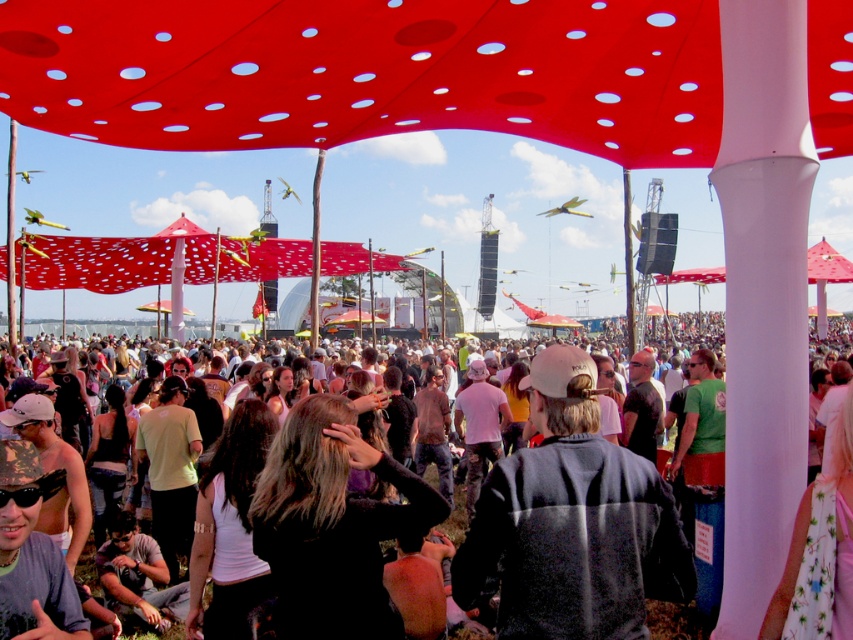
You are standing at the festival and want to take a photo of both the point at coordinates point (321,614) and the point at coordinates point (502,408). Which point should you focus on first to ensure both are in focus?

You should focus on the point at coordinates point (321,614) first because it is closer to the camera than the point at coordinates point (502,408). This way, both points will be in focus as the closer point sets the focal plane.

You are planning to install a new red perforated canopy at upper center for an event. The existing black casual clothing at center is already occupying space. Based on the current setup, will the new canopy be wider or narrower than the clothing area?

The red perforated canopy at upper center has a lesser width compared to the black casual clothing at center, so the new canopy will be narrower than the clothing area.